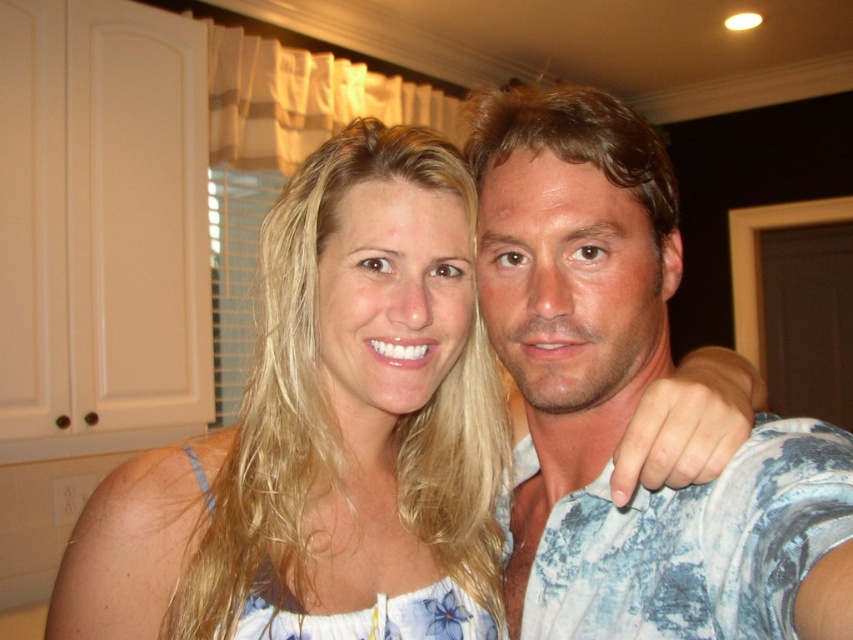
Question: Is blonde hair at center smaller than blue tie-dye shirt at right?

Choices:
 (A) no
 (B) yes

Answer: (B)

Question: Which object is closer to the camera taking this photo?

Choices:
 (A) blue tie-dye shirt at right
 (B) blonde hair at center

Answer: (A)

Question: Which object appears farthest from the camera in this image?

Choices:
 (A) blonde hair at center
 (B) blue tie-dye shirt at right

Answer: (A)

Question: Observing the image, what is the correct spatial positioning of blonde hair at center in reference to blue tie-dye shirt at right?

Choices:
 (A) above
 (B) below

Answer: (B)

Question: Considering the relative positions of blonde hair at center and blue tie-dye shirt at right in the image provided, where is blonde hair at center located with respect to blue tie-dye shirt at right?

Choices:
 (A) right
 (B) left

Answer: (B)